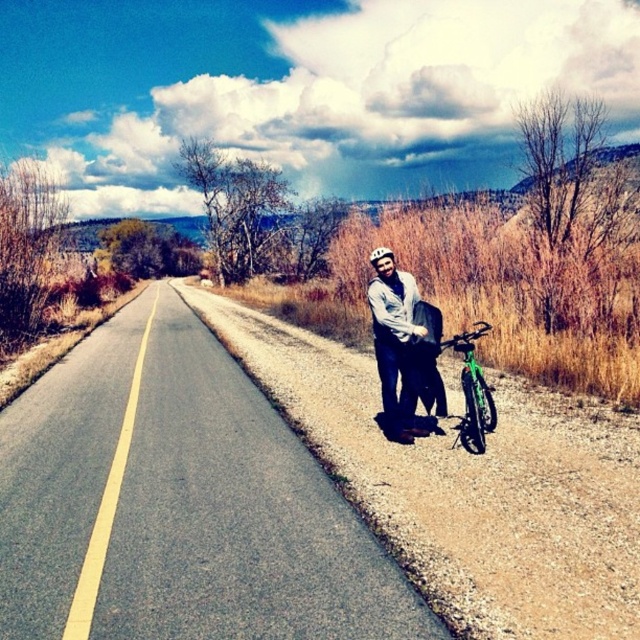
You are a delivery drone operator. Your drone is currently hovering 10 meters above the ground. You need to deliver a package to the matte gray helmet at right. According to the image, is the drone within the required 10 meter delivery radius?

The matte gray helmet at right is 8.18 meters from camera. Since the drone is hovering 10 meters above the ground, the straight line distance between the drone and the helmet is sqrt 8.18 squared plus 10 squared which is approximately 13 meters. This exceeds the 10 meter delivery radius. The drone is too far to deliver.

You are a photographer trying to capture the scene with a camera that has a limited depth of field. You want to focus on both points in the image labeled as point (406, 371) and point (378, 250). Given that your camera can only sharply focus on objects at a single distance from the lens, which point should you focus on to ensure the other point is still in acceptable focus?

You should focus on point (406, 371) because it is closer to the camera. Since depth of field extends farther behind the point of focus than in front, focusing on the closer point will allow the farther point (378, 250) to remain within the acceptable focus range.